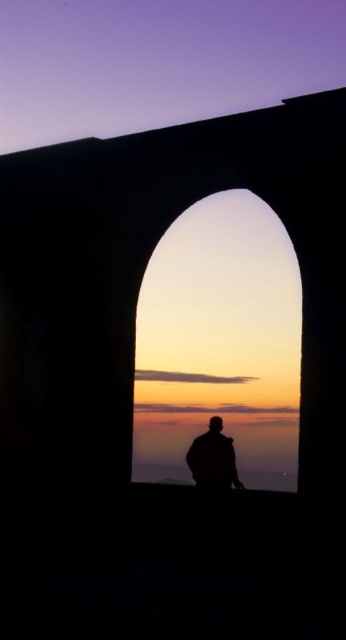
You are an architect analyzing the placement of the matte stone archway at center in the scene. Given its coordinates at point 0.537, 0.636, how does this position affect its visual prominence compared to other elements in the sunset backdrop?

The matte stone archway at center is positioned at coordinates [220,342], which places it centrally within the frame, enhancing its visual prominence as it serves as the focal point framing the vibrant sunset backdrop.

You are standing in front of the arched opening looking at the sunset. There are two points marked in the image. The first point is at coordinate point (268, 458) and the second point is at coordinate point (196, 476). Which point is closer to you?

Point (196, 476) is closer to you because the Objects Description states that point (268, 458) is further to the camera than point (196, 476).